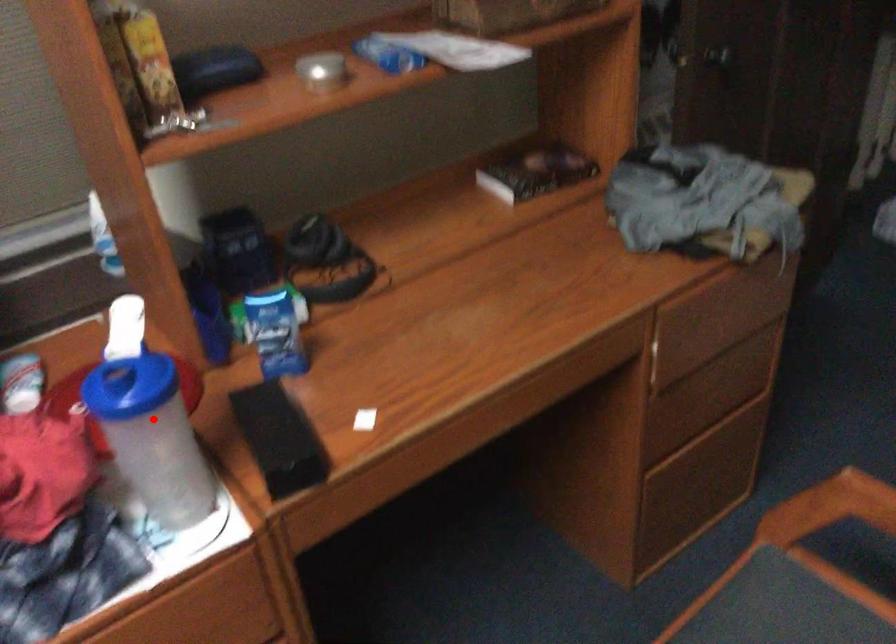
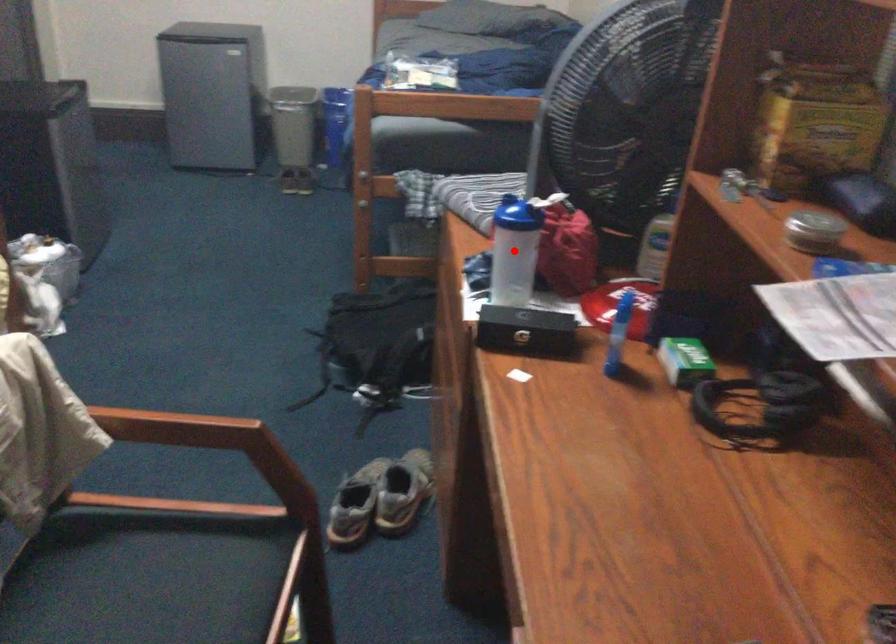
I am providing you with two images of the same scene from different viewpoints. A red point is marked on the first image and another point is marked on the second image. Are the points marked in image1 and image2 representing the same 3D position?

Yes